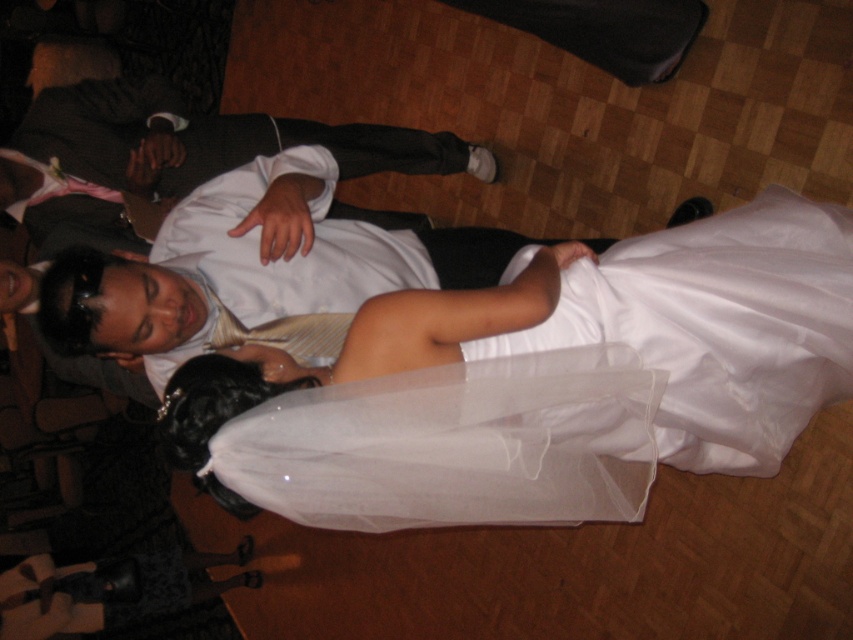
Measure the distance between white sheer dress at center and camera.

The distance of white sheer dress at center from camera is 94.24 centimeters.

Is white sheer dress at center taller than white satin shirt at center?

Indeed, white sheer dress at center has a greater height compared to white satin shirt at center.

Which is behind, point (743, 428) or point (201, 204)?

The point (201, 204) is more distant.

Identify the location of white sheer dress at center. The width and height of the screenshot is (853, 640). (579, 388).